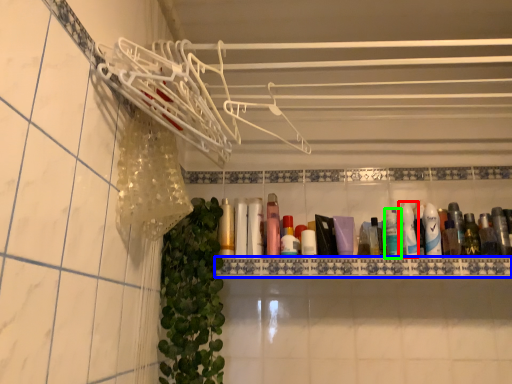
Question: Based on their relative distances, which object is nearer to toiletry (highlighted by a red box)? Choose from ledge (highlighted by a blue box) and mouthwash (highlighted by a green box).

Choices:
 (A) ledge
 (B) mouthwash

Answer: (B)